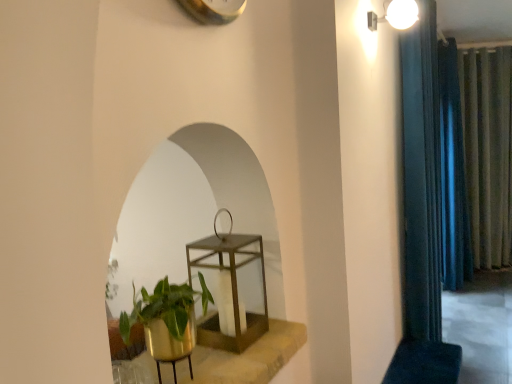
Question: Is white glossy light fixture at upper right facing away from blue velvet curtain at right, acting as the first curtain starting from the left?

Choices:
 (A) no
 (B) yes

Answer: (A)

Question: Is blue velvet curtain at right, which is counted as the 3th curtain, starting from the right, inside white glossy light fixture at upper right?

Choices:
 (A) no
 (B) yes

Answer: (A)

Question: Is white glossy light fixture at upper right to the left of blue velvet curtain at right, which is counted as the 3th curtain, starting from the right, from the viewer's perspective?

Choices:
 (A) yes
 (B) no

Answer: (A)

Question: Can we say white glossy light fixture at upper right lies outside blue velvet curtain at right, the first curtain in the front-to-back sequence?

Choices:
 (A) yes
 (B) no

Answer: (A)

Question: Can you confirm if white glossy light fixture at upper right is bigger than blue velvet curtain at right, which appears as the third curtain when viewed from the back?

Choices:
 (A) yes
 (B) no

Answer: (B)

Question: Is the depth of white glossy light fixture at upper right greater than that of blue velvet curtain at right, which appears as the third curtain when viewed from the back?

Choices:
 (A) yes
 (B) no

Answer: (B)

Question: From the image's perspective, is white glossy light fixture at upper right under green textured curtain at right, the first curtain from the right?

Choices:
 (A) no
 (B) yes

Answer: (A)

Question: Is white glossy light fixture at upper right touching green textured curtain at right, the first curtain from the right?

Choices:
 (A) no
 (B) yes

Answer: (A)

Question: From a real-world perspective, is white glossy light fixture at upper right physically above green textured curtain at right, which is counted as the 3th curtain, starting from the left?

Choices:
 (A) yes
 (B) no

Answer: (A)

Question: Does white glossy light fixture at upper right appear on the left side of green textured curtain at right, which is counted as the 3th curtain, starting from the left?

Choices:
 (A) no
 (B) yes

Answer: (B)

Question: Is the depth of white glossy light fixture at upper right greater than that of green textured curtain at right, the first curtain from the right?

Choices:
 (A) yes
 (B) no

Answer: (B)

Question: Is white glossy light fixture at upper right thinner than green textured curtain at right, the third curtain positioned from the front?

Choices:
 (A) no
 (B) yes

Answer: (A)

Question: Considering the relative positions of blue velvet curtain at right, the first curtain in the front-to-back sequence, and gold metallic plant pot at lower left in the image provided, is blue velvet curtain at right, the first curtain in the front-to-back sequence, behind gold metallic plant pot at lower left?

Choices:
 (A) yes
 (B) no

Answer: (A)